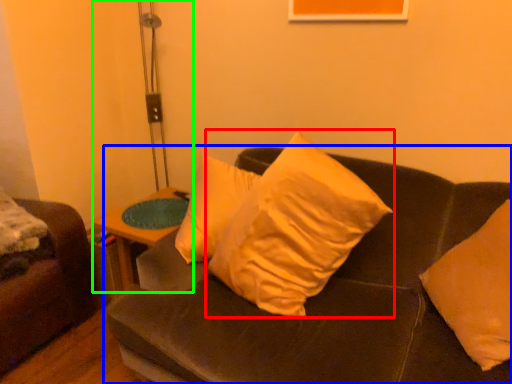
Question: Estimate the real-world distances between objects in this image. Which object is farther from pillow (highlighted by a red box), studio couch (highlighted by a blue box) or table lamp (highlighted by a green box)?

Choices:
 (A) studio couch
 (B) table lamp

Answer: (B)